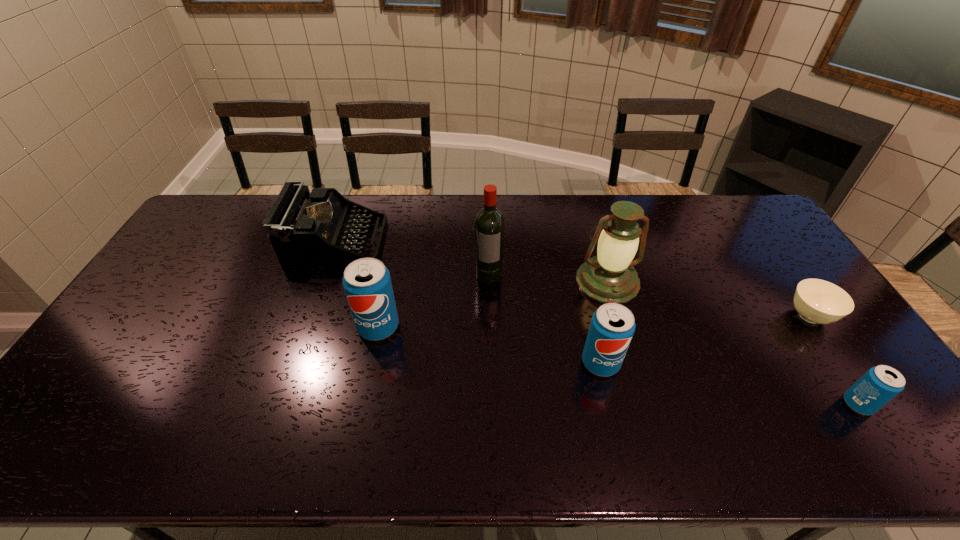
The height and width of the screenshot is (540, 960). What are the coordinates of `blank region between the sugar bowl and the sixth farthest object` in the screenshot? It's located at (705, 340).

This screenshot has height=540, width=960. Find the location of `empty space that is in between the third object from left to right and the farthest soda can`. empty space that is in between the third object from left to right and the farthest soda can is located at coordinates (434, 300).

Choose which object is the nearest neighbor to the typewriter. Please provide its 2D coordinates. Your answer should be formatted as a tuple, i.e. [(x, y)], where the tuple contains the x and y coordinates of a point satisfying the conditions above.

[(367, 284)]

The height and width of the screenshot is (540, 960). Find the location of `object that stands as the fourth closest to the typewriter`. object that stands as the fourth closest to the typewriter is located at coordinates (612, 326).

Where is `the closest soda can to the lantern`? This screenshot has width=960, height=540. the closest soda can to the lantern is located at coordinates tap(612, 326).

Locate an element on the screen. The height and width of the screenshot is (540, 960). soda can identified as the closest to the second soda can from right to left is located at coordinates (367, 284).

Find the location of a particular element. The width and height of the screenshot is (960, 540). vacant space that satisfies the following two spatial constraints: 1. on the front side of the second tallest soda can; 2. on the right side of the farthest soda can is located at coordinates (371, 363).

Locate an element on the screen. The image size is (960, 540). vacant space that satisfies the following two spatial constraints: 1. on the typing side of the third shortest object; 2. on the back side of the second nearest object is located at coordinates [293, 363].

Locate an element on the screen. blank space that satisfies the following two spatial constraints: 1. on the typing side of the second nearest soda can; 2. on the left side of the typewriter is located at coordinates (293, 363).

Find the location of a particular element. The image size is (960, 540). vacant space that satisfies the following two spatial constraints: 1. on the typing side of the third shortest object; 2. on the left side of the sugar bowl is located at coordinates (309, 316).